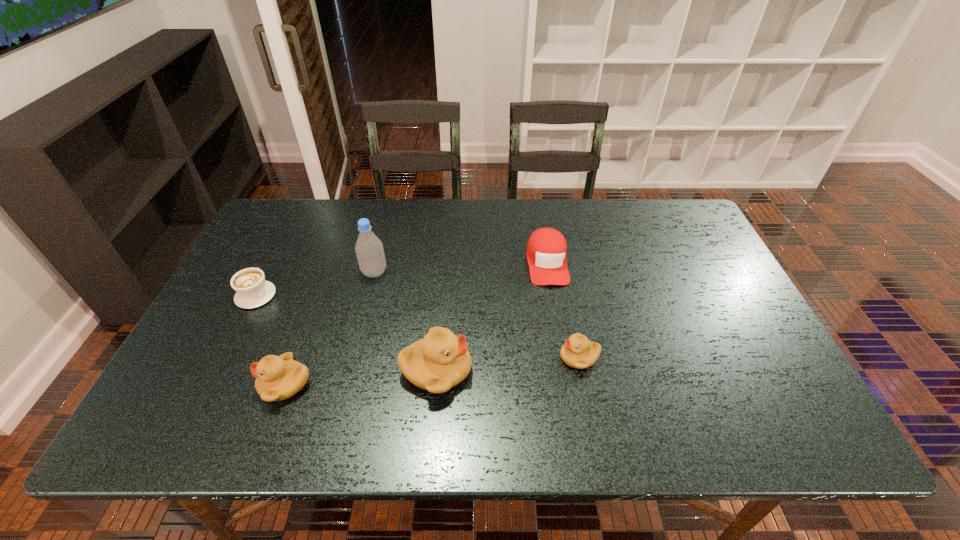
The image size is (960, 540). Identify the location of free space between the fourth object from right to left and the second tallest duckling. (330, 328).

I want to click on free space between the third object from left to right and the third object from right to left, so click(405, 321).

Identify the location of unoccupied area between the leftmost object and the shortest duckling. (418, 326).

Locate an element on the screen. The image size is (960, 540). empty space between the shortest duckling and the third object from left to right is located at coordinates (477, 315).

Locate an element on the screen. free space between the second duckling from left to right and the rightmost duckling is located at coordinates (508, 364).

Identify which object is located as the second nearest to the shortest duckling. Please provide its 2D coordinates. Your answer should be formatted as a tuple, i.e. [(x, y)], where the tuple contains the x and y coordinates of a point satisfying the conditions above.

[(438, 362)]

Identify which object is located as the fifth nearest to the rightmost duckling. Please provide its 2D coordinates. Your answer should be formatted as a tuple, i.e. [(x, y)], where the tuple contains the x and y coordinates of a point satisfying the conditions above.

[(252, 290)]

Identify which duckling is located as the nearest to the leftmost duckling. Please provide its 2D coordinates. Your answer should be formatted as a tuple, i.e. [(x, y)], where the tuple contains the x and y coordinates of a point satisfying the conditions above.

[(438, 362)]

Locate which duckling is the second closest to the leftmost duckling. Please provide its 2D coordinates. Your answer should be formatted as a tuple, i.e. [(x, y)], where the tuple contains the x and y coordinates of a point satisfying the conditions above.

[(578, 352)]

Image resolution: width=960 pixels, height=540 pixels. In order to click on vacant space that satisfies the following two spatial constraints: 1. on the front side of the third object from left to right; 2. at the beak of the second object from left to right in this screenshot , I will do `click(347, 384)`.